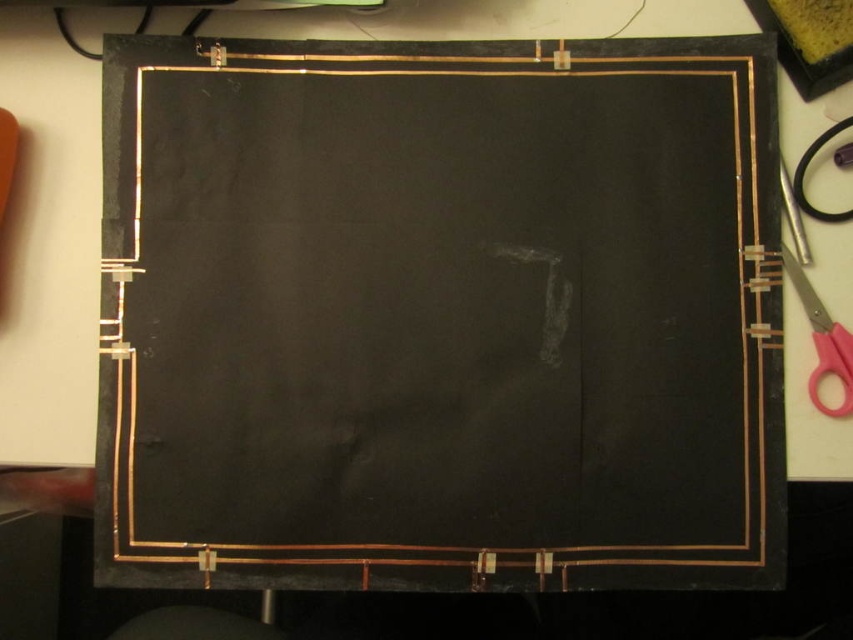
Can you confirm if black matte board at center is positioned above pink plastic scissors at right?

Yes.

Between black matte board at center and pink plastic scissors at right, which one is positioned higher?

black matte board at center

I want to click on black matte board at center, so click(x=438, y=316).